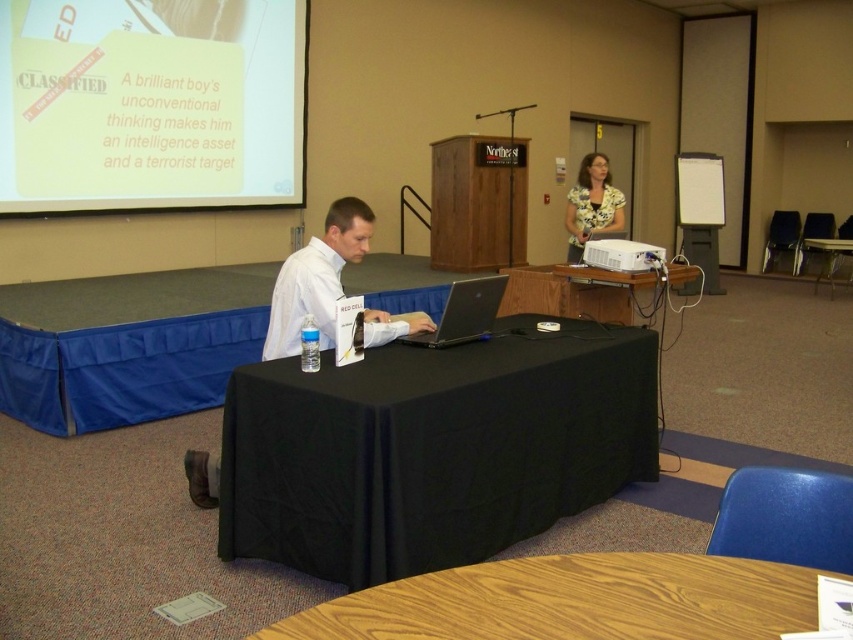
Question: Which object is positioned farthest from the wooden table at lower center?

Choices:
 (A) black fabric table at center
 (B) black matte laptop at center
 (C) white plastic projector at upper center
 (D) matte yellow blouse at upper right

Answer: (D)

Question: Is yellow paper at upper left to the left of wooden table at lower center from the viewer's perspective?

Choices:
 (A) no
 (B) yes

Answer: (B)

Question: Which object is farther from the camera taking this photo?

Choices:
 (A) black fabric table at center
 (B) matte yellow blouse at upper right
 (C) black matte laptop at center

Answer: (B)

Question: Which object is farther from the camera taking this photo?

Choices:
 (A) white plastic projector at upper center
 (B) black fabric table at center
 (C) wooden table at lower center

Answer: (A)

Question: Is wooden table at lower center below white plastic projector at upper center?

Choices:
 (A) yes
 (B) no

Answer: (A)

Question: From the image, what is the correct spatial relationship of yellow paper at upper left in relation to matte yellow blouse at upper right?

Choices:
 (A) above
 (B) below

Answer: (A)